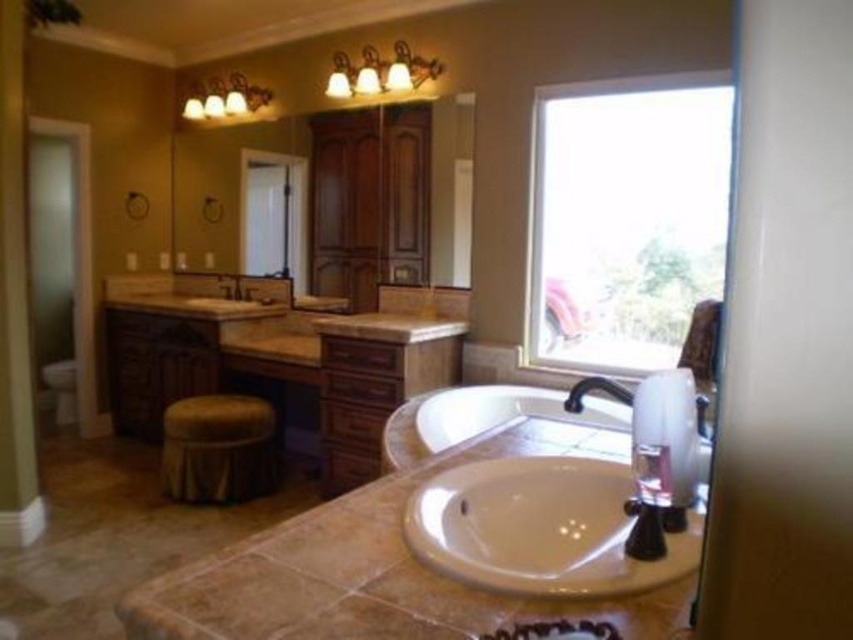
You are a window installer and need to replace the clear glass window at upper right and the white glossy bathtub at center with new ones. Given that the new window and bathtub are the same size as the originals, will the new bathtub fit in the space where the old one was?

The clear glass window at upper right has a larger size compared to white glossy bathtub at center. Since the new bathtub is the same size as the original, it will fit in the space where the old one was because the original bathtub was smaller than the window.